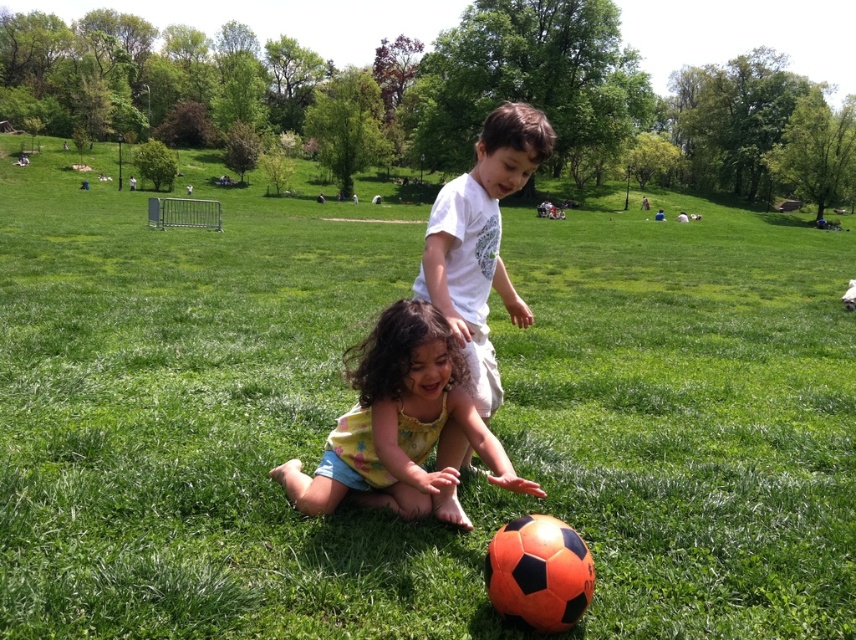
Question: Which point is farther from the camera taking this photo?

Choices:
 (A) (377, 392)
 (B) (488, 124)

Answer: (B)

Question: Which point is farther to the camera?

Choices:
 (A) yellow floral dress at center
 (B) white cotton shirt at center

Answer: (B)

Question: Can you confirm if yellow floral dress at center is wider than white cotton shirt at center?

Choices:
 (A) no
 (B) yes

Answer: (B)

Question: Is yellow floral dress at center positioned behind white cotton shirt at center?

Choices:
 (A) no
 (B) yes

Answer: (A)

Question: Is yellow floral dress at center to the left of white cotton shirt at center from the viewer's perspective?

Choices:
 (A) yes
 (B) no

Answer: (A)